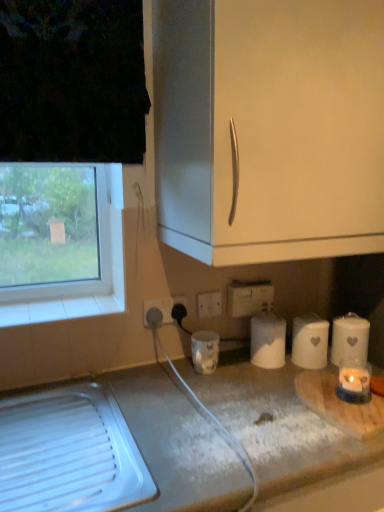
Where is `vacant space in between wooden cutting board at lower right and white ceramic candle at lower center`? The image size is (384, 512). vacant space in between wooden cutting board at lower right and white ceramic candle at lower center is located at coordinates (253, 386).